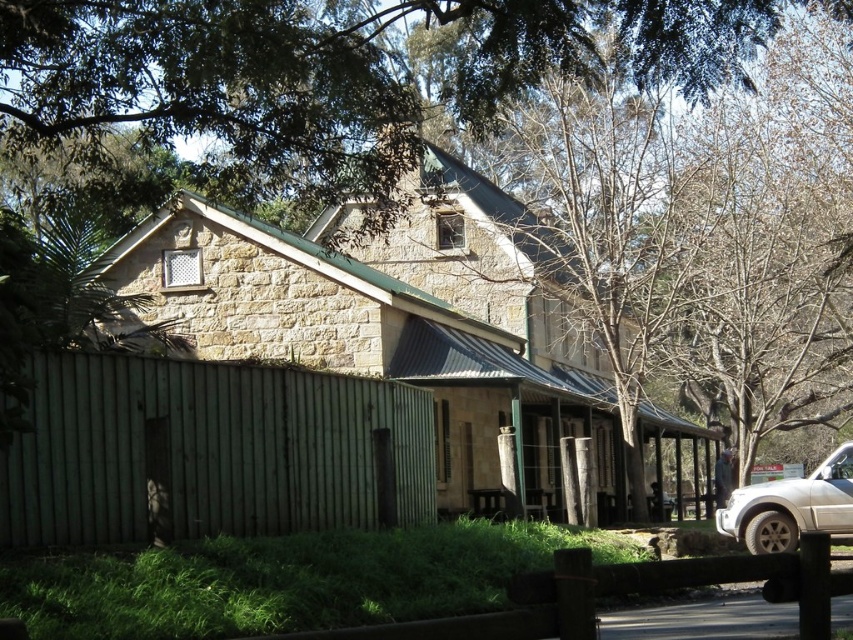
Question: Which is farther from the white matte suv at lower right?

Choices:
 (A) stone church at center
 (B) green wooden fence at lower left

Answer: (A)

Question: Does stone church at center appear under green wooden fence at lower left?

Choices:
 (A) no
 (B) yes

Answer: (B)

Question: Can you confirm if stone church at center is smaller than green wooden fence at lower left?

Choices:
 (A) no
 (B) yes

Answer: (A)

Question: Which is farther from the white matte suv at lower right?

Choices:
 (A) green wooden fence at lower left
 (B) stone church at center

Answer: (B)

Question: Can you confirm if green wooden fence at lower left is positioned to the left of white matte suv at lower right?

Choices:
 (A) yes
 (B) no

Answer: (A)

Question: Based on their relative distances, which object is farther from the green wooden fence at lower left?

Choices:
 (A) white matte suv at lower right
 (B) stone church at center

Answer: (B)